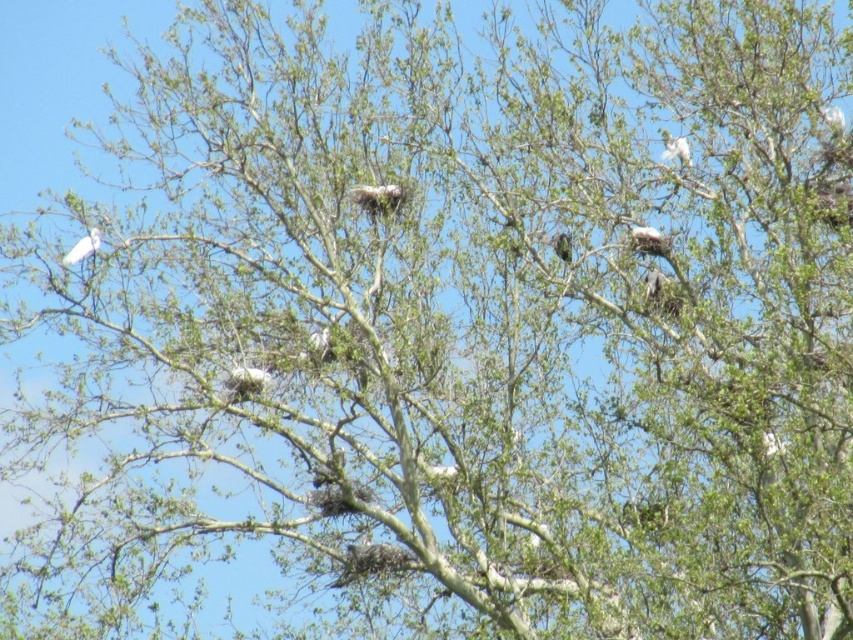
You are a birdwatcher standing 10 feet away from the tree. You want to observe both the white fluffy nest at upper right and the green textured bird at center without moving your position. Can you see both at the same time through your binoculars with a 10x magnification? Explain why or why not.

The white fluffy nest at upper right and the green textured bird at center are 6.17 feet apart. Since the binoculars have a 10x magnification, which typically has a field of view of about 6.5 feet at 100 yards, the 6.17 feet distance between them would likely fit within the binoculars field of view. Therefore, you can see both at the same time without moving your position.

You are a birdwatcher observing the tree. You notice the white fluffy nest at upper right and the green textured bird at center. Which one has a larger width?

The white fluffy nest at upper right might be wider than the green textured bird at center.

You are a birdwatcher observing the tree from below. You notice the white fluffy nest at upper right and the green textured bird at center. Which object is higher up in the tree?

The white fluffy nest at upper right is positioned over the green textured bird at center, so it is higher up in the tree.